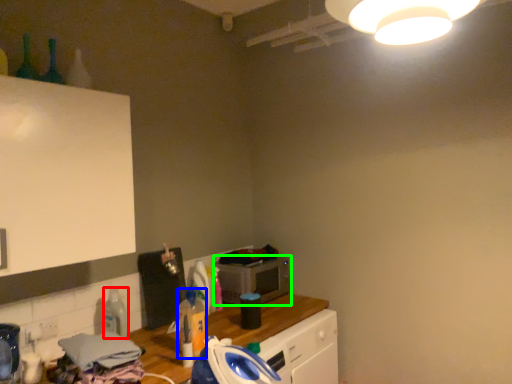
Question: Estimate the real-world distances between objects in this image. Which object is closer to bottle (highlighted by a red box), bottle (highlighted by a blue box) or microwave oven (highlighted by a green box)?

Choices:
 (A) bottle
 (B) microwave oven

Answer: (A)